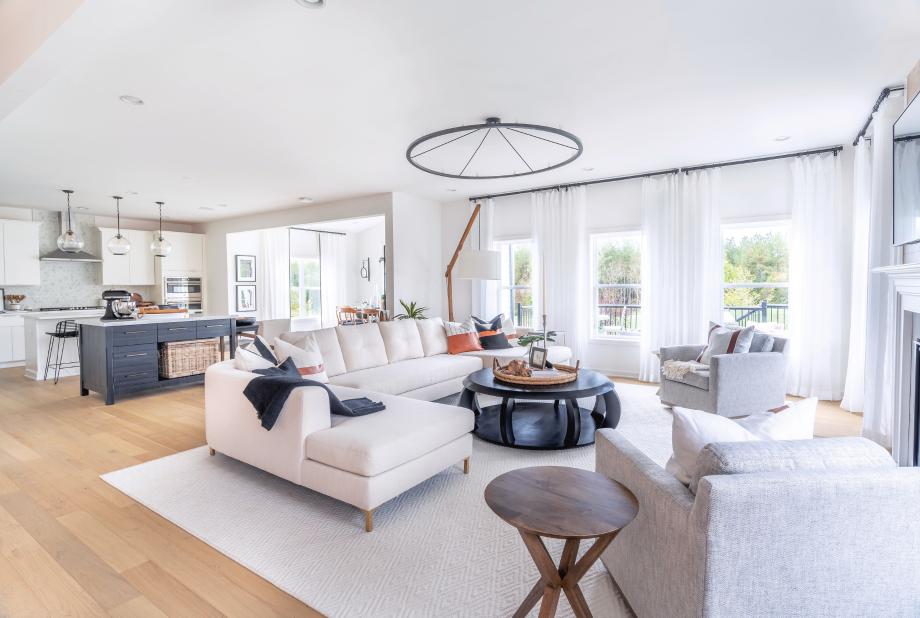
Where is `window`? window is located at coordinates click(x=301, y=298), click(x=513, y=295), click(x=619, y=289), click(x=748, y=293).